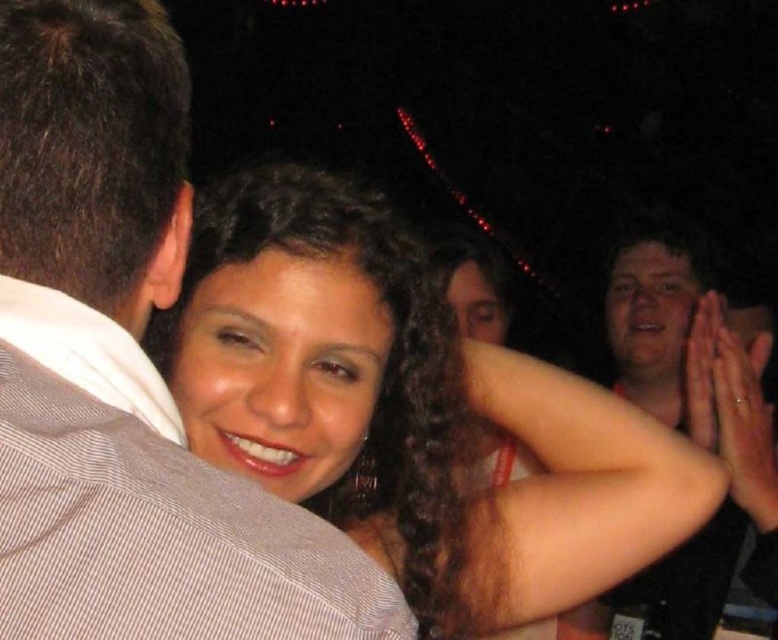
Question: Is matte brown hair at center above smooth skin hands at right?

Choices:
 (A) yes
 (B) no

Answer: (B)

Question: Which of the following is the closest to the observer?

Choices:
 (A) (366, 387)
 (B) (142, 161)

Answer: (B)

Question: Can you confirm if white striped shirt at left is smaller than smooth skin hands at right?

Choices:
 (A) no
 (B) yes

Answer: (B)

Question: Is matte brown hair at center smaller than smooth skin hands at right?

Choices:
 (A) yes
 (B) no

Answer: (B)

Question: Which object is closer to the camera taking this photo?

Choices:
 (A) smooth skin hands at right
 (B) white striped shirt at left

Answer: (B)

Question: Among these points, which one is nearest to the camera?

Choices:
 (A) (9, 256)
 (B) (373, 314)
 (C) (622, 593)

Answer: (A)